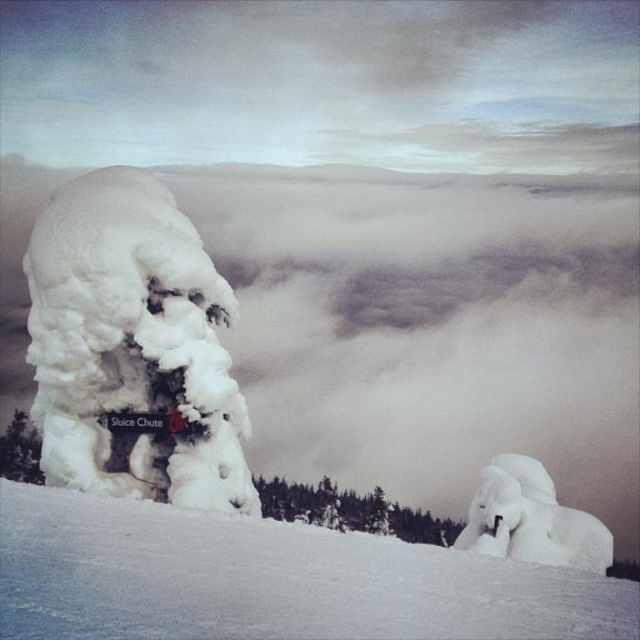
You are standing in the winter landscape described. You want to place a small snowman exactly at the point indicated by point (268, 579). What is the terrain like at that location?

The point (268, 579) indicates white snow at lower center, so the terrain there is flat and covered in thick, pristine snow, suitable for building a snowman.

You are an observer standing in the winter landscape. You notice two snow patches, the white snow at lower center and the white fluffy snow at left. Which one is larger in size?

The white fluffy snow at left is larger than the white snow at lower center.

You are standing at the bottom of the winter landscape and want to move towards the top. Which point, point (586, 593) or point (184, 294), is closer to your current position?

Point (586, 593) is in front of point (184, 294), so it is closer to your current position at the bottom of the winter landscape.